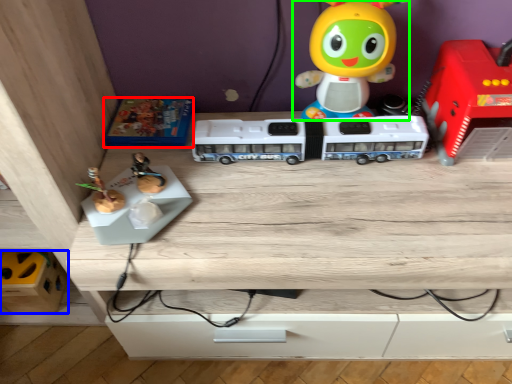
Question: Which is nearer to the toy (highlighted by a red box)? toy (highlighted by a blue box) or toy (highlighted by a green box).

Choices:
 (A) toy
 (B) toy

Answer: (B)